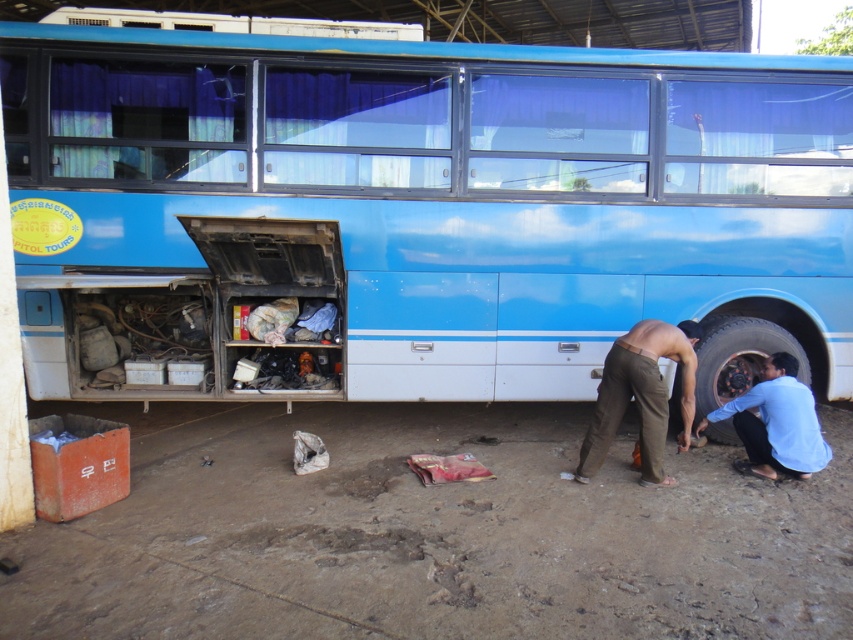
You are standing at the entrance of the bus repair station and see the brown cotton pants at lower center. Where exactly are the brown cotton pants located in the scene?

The brown cotton pants at lower center are located at point (641, 396) in the scene.